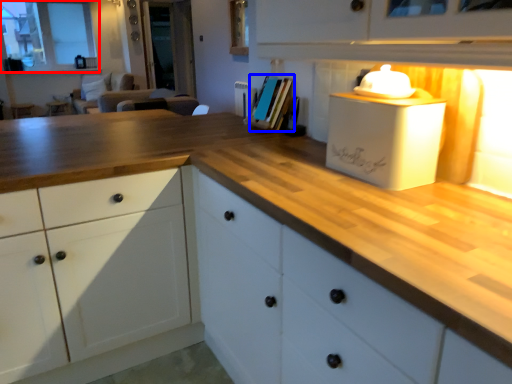
Question: Which object is further to the camera taking this photo, window (highlighted by a red box) or book (highlighted by a blue box)?

Choices:
 (A) window
 (B) book

Answer: (A)